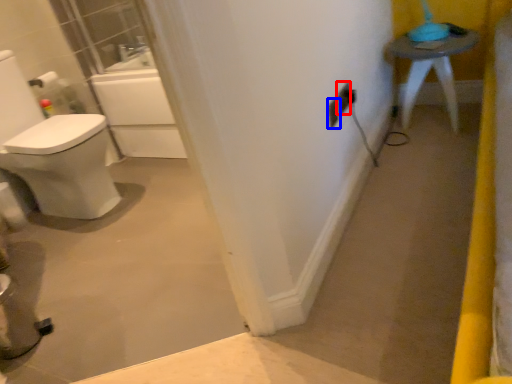
Question: Which of the following is the closest to the observer, electric outlet (highlighted by a red box) or electric outlet (highlighted by a blue box)?

Choices:
 (A) electric outlet
 (B) electric outlet

Answer: (B)